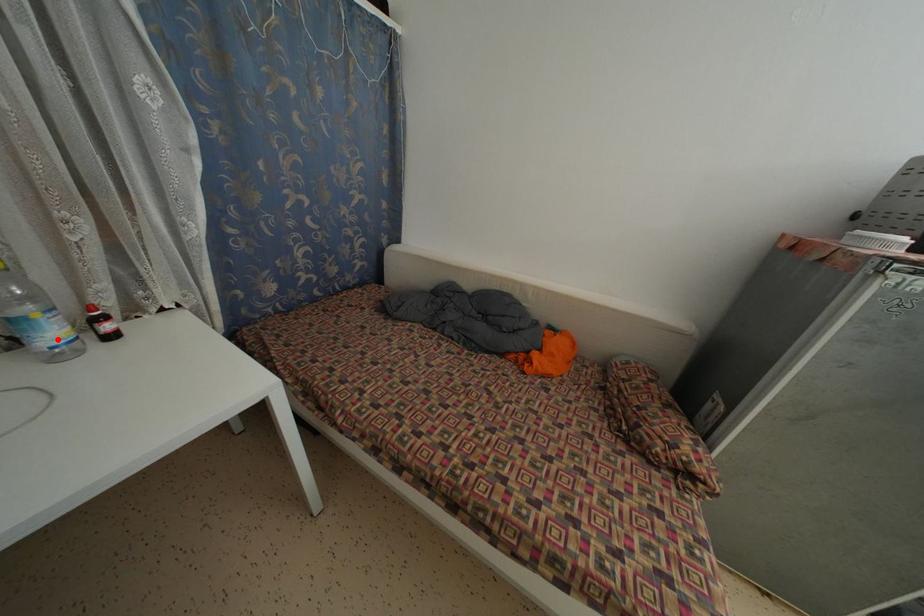
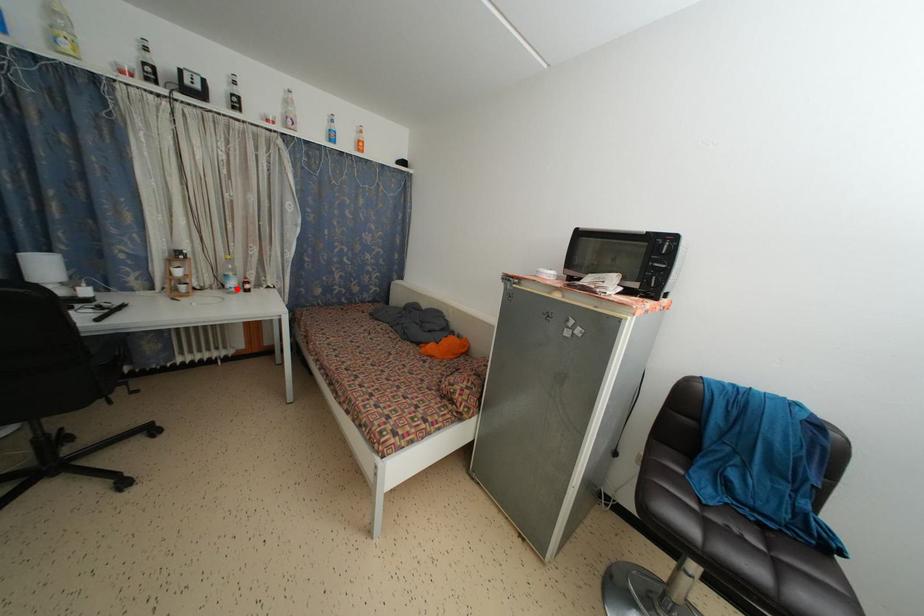
I am providing you with two images of the same scene from different viewpoints. A red point is marked on the first image and another point is marked on the second image. Is the marked point in image1 the same physical position as the marked point in image2?

Yes